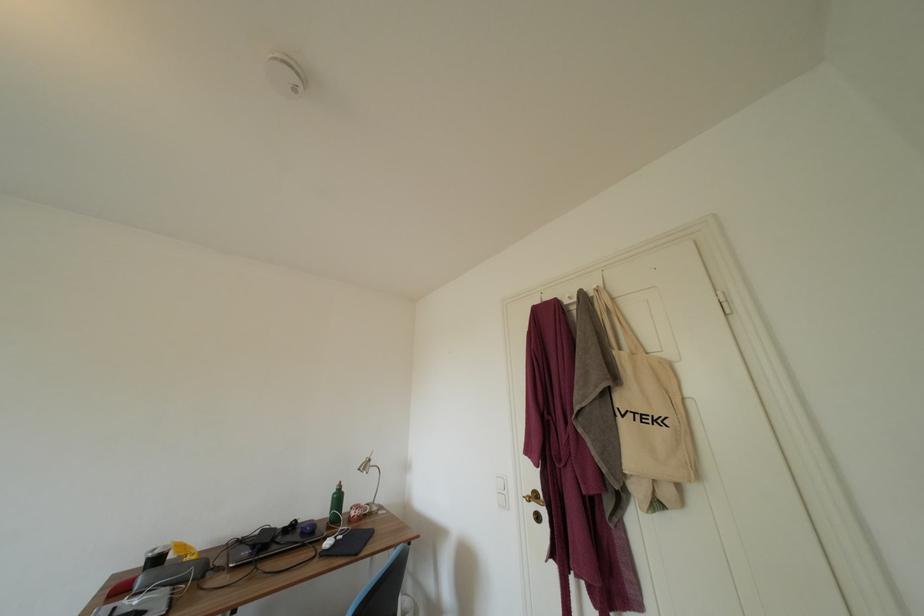
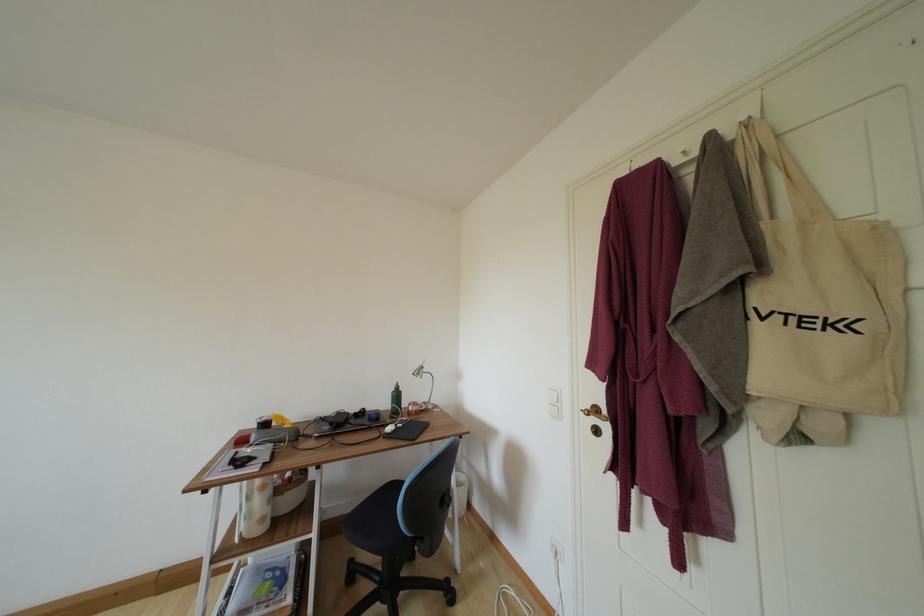
The point at (297, 531) is marked in the first image. Where is the corresponding point in the second image?

(367, 416)